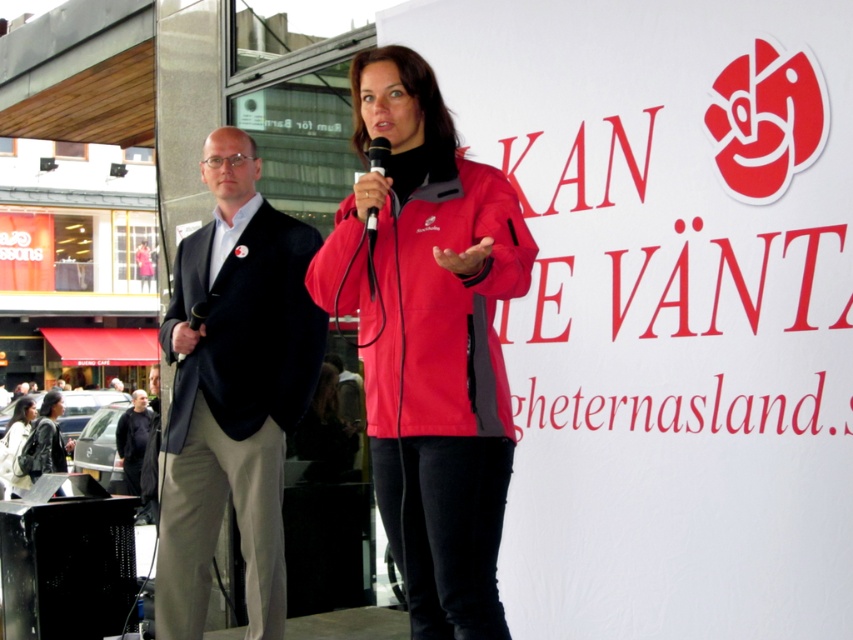
Question: Does red softshell jacket at center appear under black woolen jacket at left?

Choices:
 (A) no
 (B) yes

Answer: (A)

Question: Does matte black suit at left have a lesser width compared to red softshell jacket at center?

Choices:
 (A) yes
 (B) no

Answer: (B)

Question: Which object is positioned farthest from the leather jacket at lower left?

Choices:
 (A) black plastic microphone at center
 (B) red softshell jacket at center

Answer: (A)

Question: Based on their relative distances, which object is nearer to the matte black suit at left?

Choices:
 (A) black matte jacket at center
 (B) black plastic microphone at center
 (C) leather jacket at lower left

Answer: (B)

Question: Is matte black suit at left thinner than black woolen jacket at left?

Choices:
 (A) no
 (B) yes

Answer: (A)

Question: Which of the following is the closest to the observer?

Choices:
 (A) (190, 326)
 (B) (56, 403)
 (C) (20, 483)
 (D) (485, 416)

Answer: (D)